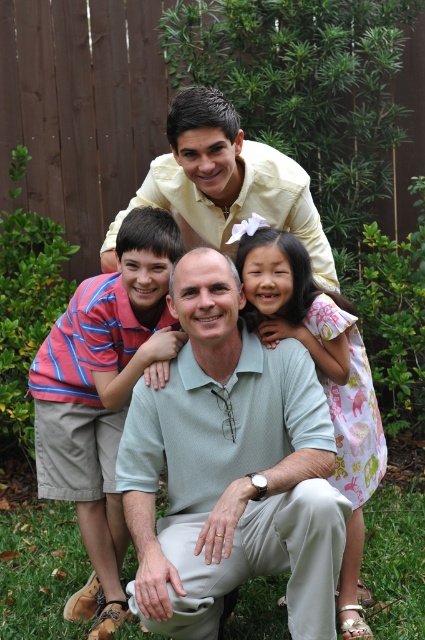
You are a photographer trying to capture the striped cotton shirt at left and the matte yellow shirt at upper center in the same frame. Which shirt should you focus on first to ensure both are in focus, considering their sizes?

The striped cotton shirt at left is smaller in size compared to the matte yellow shirt at upper center. To ensure both are in focus, you should focus on the smaller striped cotton shirt first, as it requires more precise focusing due to its smaller size.

You are standing at the origin point of the image coordinate system. The origin is at the bottom left corner of the image. The x and y axes increase to the right and upwards respectively. You want to place a small flag at the green grass at lower center. What are the coordinates where you should place the flag?

The coordinates for the green grass at lower center are at point (39,572). So you should place the flag at coordinates 0.894 in the x direction and 0.094 in the y direction.